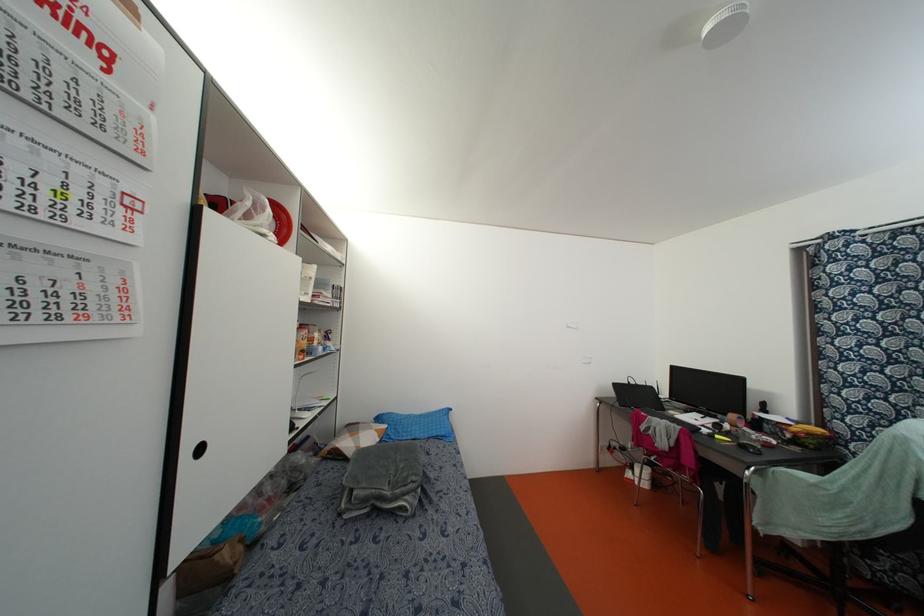
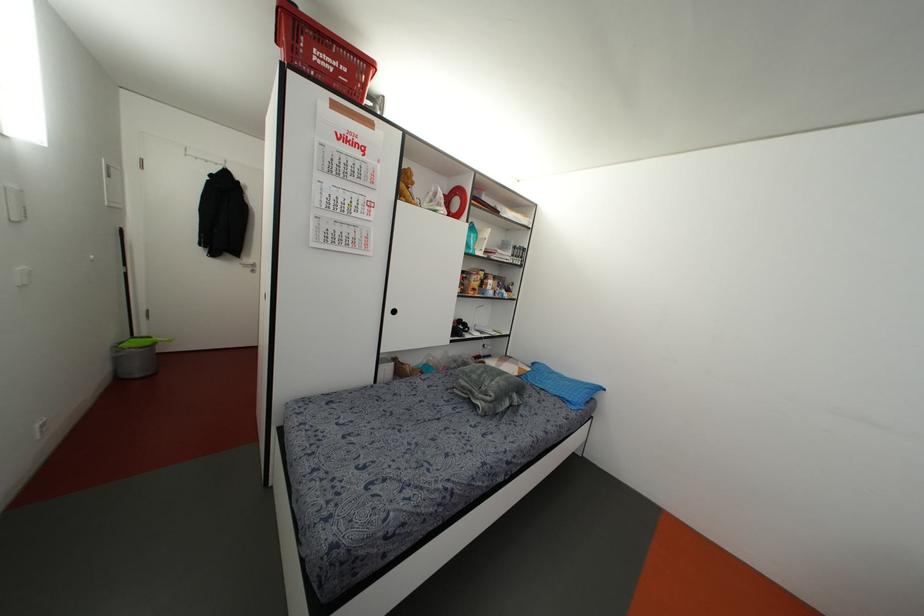
Question: The first image is from the beginning of the video and the second image is from the end. How did the camera likely rotate when shooting the video?

Choices:
 (A) Left
 (B) Right
 (C) Up
 (D) Down

Answer: (A)